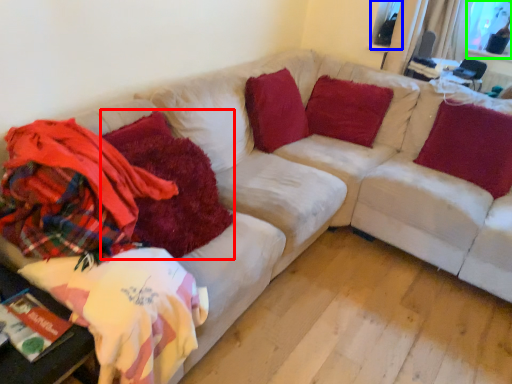
Question: Estimate the real-world distances between objects in this image. Which object is closer to blanket (highlighted by a red box), window screen (highlighted by a blue box) or window screen (highlighted by a green box)?

Choices:
 (A) window screen
 (B) window screen

Answer: (A)